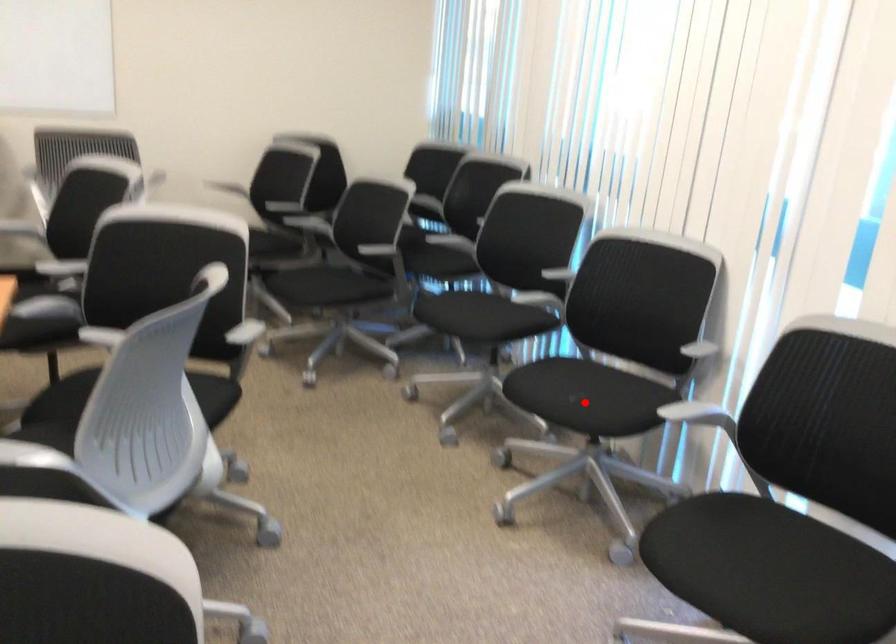
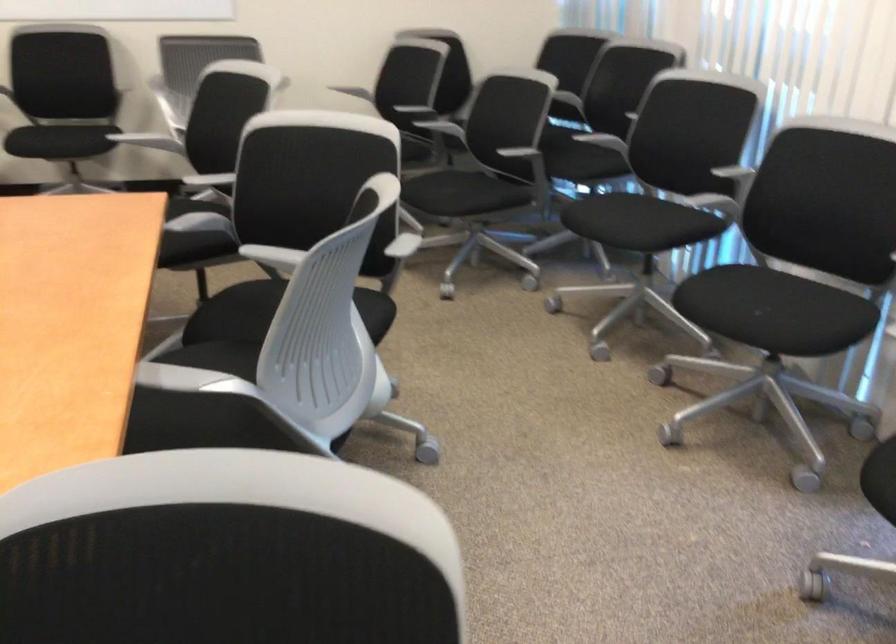
Find the pixel in the second image that matches the highlighted location in the first image.

(771, 310)